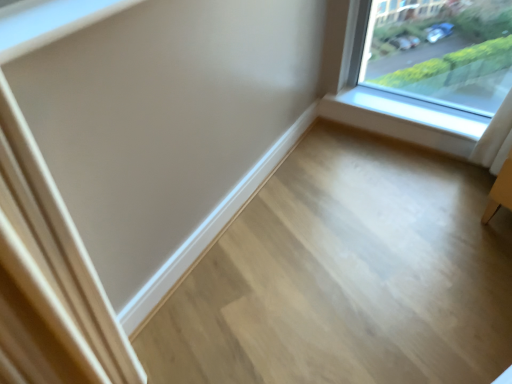
Where is `free space above white smooth window sill at upper right (from a real-world perspective)`? free space above white smooth window sill at upper right (from a real-world perspective) is located at coordinates [x=390, y=111].